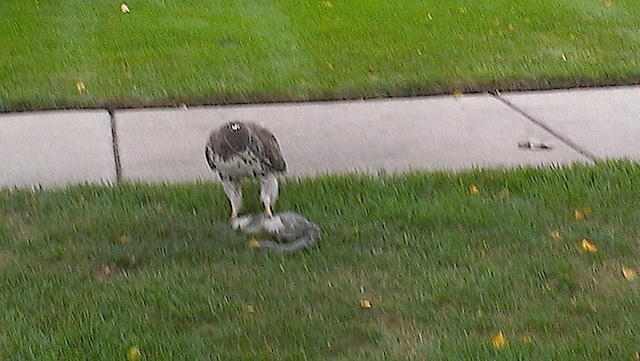
Identify the location of grey chest. Image resolution: width=640 pixels, height=361 pixels. (232, 168).